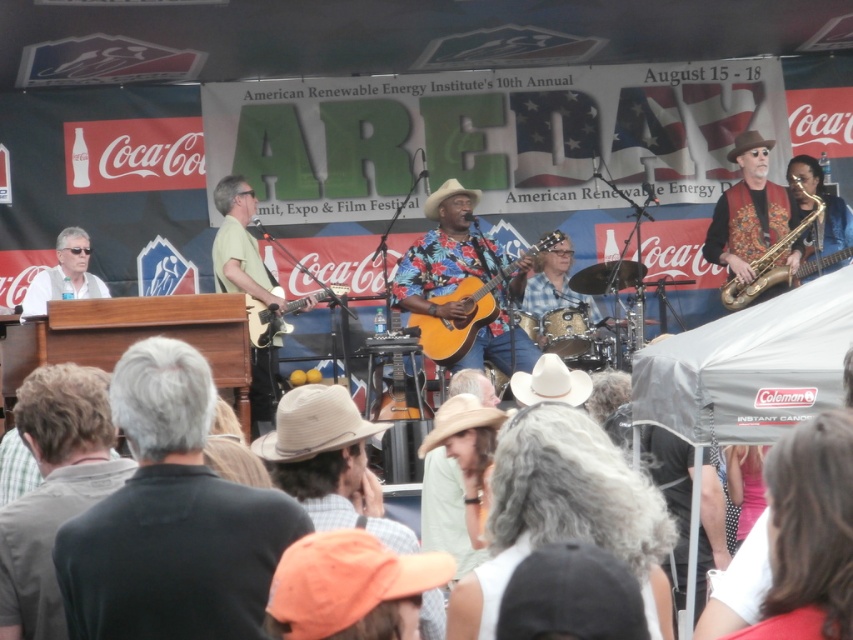
Is gray fabric shirt at lower left closer to camera compared to matte white shirt at left?

That is True.

Does point (44, 403) come farther from viewer compared to point (84, 259)?

That is False.

Identify the location of gray fabric shirt at lower left. click(53, 490).

Who is positioned more to the left, black matte shirt at center or white cotton shirt at lower right?

From the viewer's perspective, black matte shirt at center appears more on the left side.

Is point (180, 428) closer to camera compared to point (834, 572)?

No, it is not.

Where is `black matte shirt at center`? The width and height of the screenshot is (853, 640). black matte shirt at center is located at coordinates (171, 518).

At what (x,y) coordinates should I click in order to perform the action: click on white cotton shirt at lower right. Please return your answer as a coordinate pair (x, y). The width and height of the screenshot is (853, 640). Looking at the image, I should click on (809, 529).